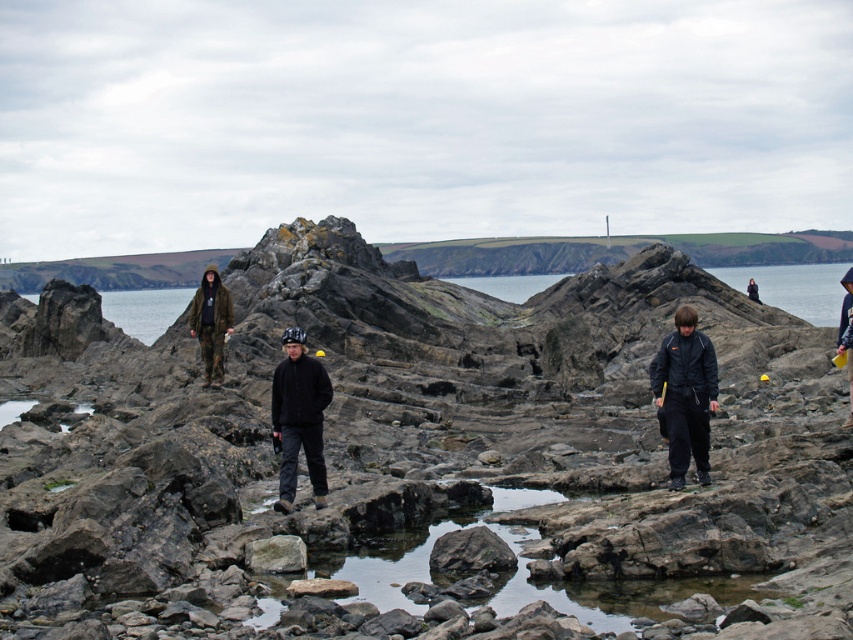
Question: Which point is closer to the camera?

Choices:
 (A) clear water at center
 (B) dark matte jacket at center
 (C) transparent water at upper right

Answer: (B)

Question: Is black softshell jacket at center thinner than dark blue jacket at right?

Choices:
 (A) no
 (B) yes

Answer: (B)

Question: Does black softshell jacket at center have a lesser width compared to dark blue jacket at right?

Choices:
 (A) yes
 (B) no

Answer: (A)

Question: Which of the following is the farthest from the observer?

Choices:
 (A) clear water at center
 (B) camouflage pants at center
 (C) gray rough rock at center

Answer: (A)

Question: Can you confirm if transparent water at upper right is positioned above clear water at center?

Choices:
 (A) yes
 (B) no

Answer: (B)

Question: Which point is closer to the camera?

Choices:
 (A) dark matte jacket at center
 (B) gray rough rock at center
 (C) clear water at center

Answer: (B)